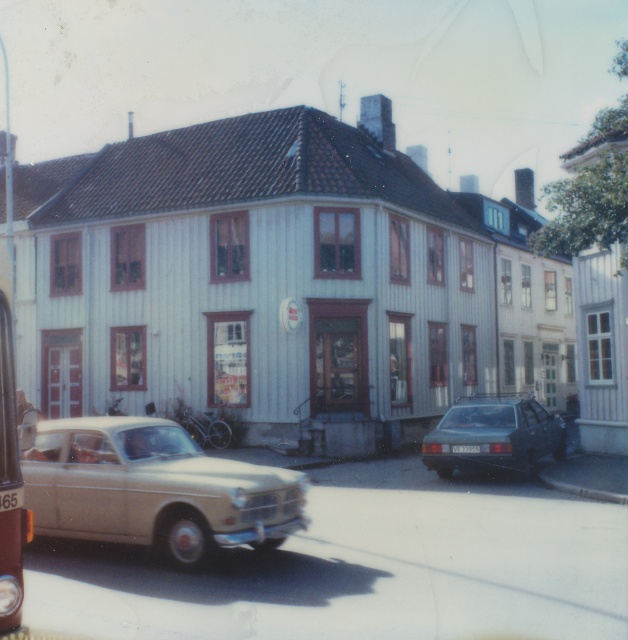
You are a delivery person trying to park your 1.8 meters wide delivery van. You see the matte black car at lower right and the white plastic license plate at center. Can your van fit in the space between them?

The matte black car at lower right might be wider than white plastic license plate at center, so the space between them may not be wide enough for your 1.8 meters wide delivery van. Please check the actual width before attempting to park.

Looking at this image, you are standing in front of the building and want to take a photo. There are two points marked in the image, point (3, 460) and point (468, 452). Which point is closer to your camera when you take the photo?

Point (3, 460) is closer to the camera than point (468, 452).

You are a pedestrian approaching the building and need to cross between the matte black car at lower right and the metallic silver bus at left. Which direction should you walk to avoid the vehicles?

The matte black car at lower right is to the right of the metallic silver bus at left, so you should walk around the left side of the metallic silver bus at left to avoid the vehicles.